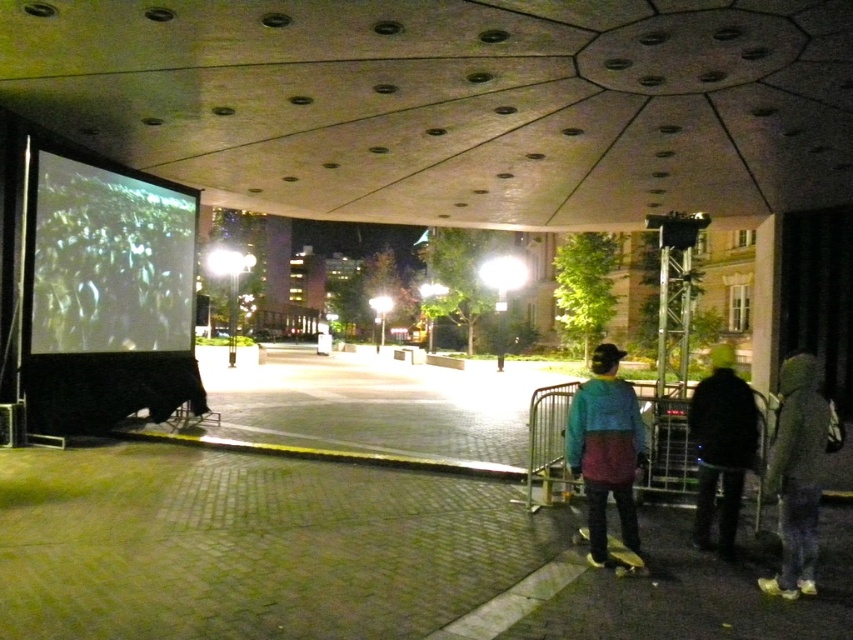
You are attending an outdoor cinema event and notice the white matte projection screen at left and the dark gray hoodie at lower right. Which object is positioned higher in the image?

The white matte projection screen at left is above the dark gray hoodie at lower right, so it is positioned higher in the image.

From the picture: You are standing at the point marked as point [605,449] in the image. What object is located exactly at that point?

The multicolored sweater at center is located exactly at point [605,449].